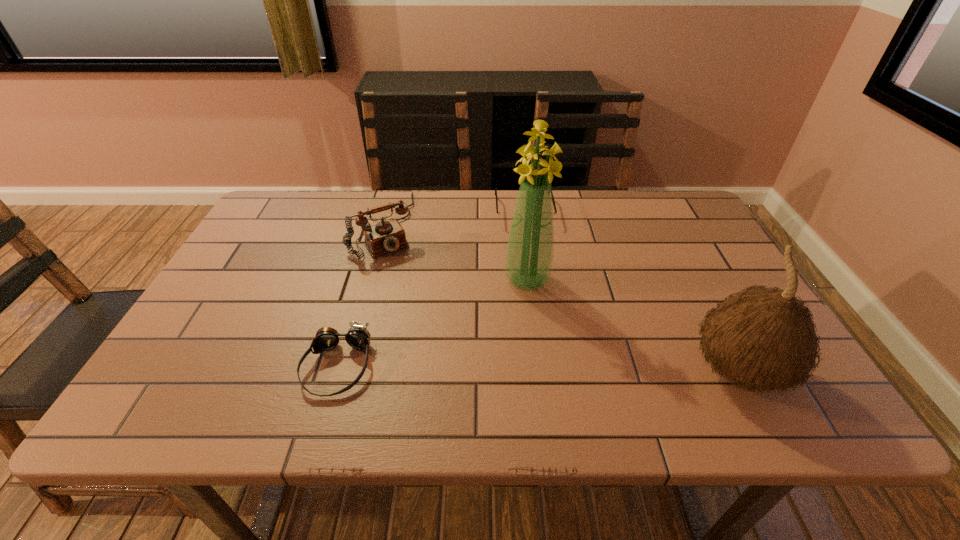
Where is `free space between the coconut and the tallest object`? This screenshot has height=540, width=960. free space between the coconut and the tallest object is located at coordinates (633, 326).

This screenshot has width=960, height=540. Identify the location of unoccupied position between the third tallest object and the spectacles. (454, 219).

You are a GUI agent. You are given a task and a screenshot of the screen. Output one action in this format:
    pyautogui.click(x=<x>, y=<y>)
    Task: Click on the free area in between the goggles and the third farthest object
    Image resolution: width=960 pixels, height=540 pixels.
    Given the screenshot: What is the action you would take?
    pyautogui.click(x=432, y=323)

Find the location of a particular element. The height and width of the screenshot is (540, 960). free space between the telephone and the rightmost object is located at coordinates (562, 299).

Image resolution: width=960 pixels, height=540 pixels. Identify the location of unoccupied area between the tallest object and the third tallest object. (456, 252).

This screenshot has height=540, width=960. Find the location of `free space between the rightmost object and the spectacles`. free space between the rightmost object and the spectacles is located at coordinates (632, 292).

Where is `vacant space that's between the rightmost object and the spectacles`? vacant space that's between the rightmost object and the spectacles is located at coordinates (632, 292).

Where is `vacant region between the spectacles and the goggles`? The width and height of the screenshot is (960, 540). vacant region between the spectacles and the goggles is located at coordinates (430, 289).

Image resolution: width=960 pixels, height=540 pixels. Identify the location of free space that is in between the goggles and the third nearest object. pyautogui.click(x=432, y=323).

Choose which object is the nearest neighbor to the goggles. Please provide its 2D coordinates. Your answer should be formatted as a tuple, i.e. [(x, y)], where the tuple contains the x and y coordinates of a point satisfying the conditions above.

[(386, 236)]